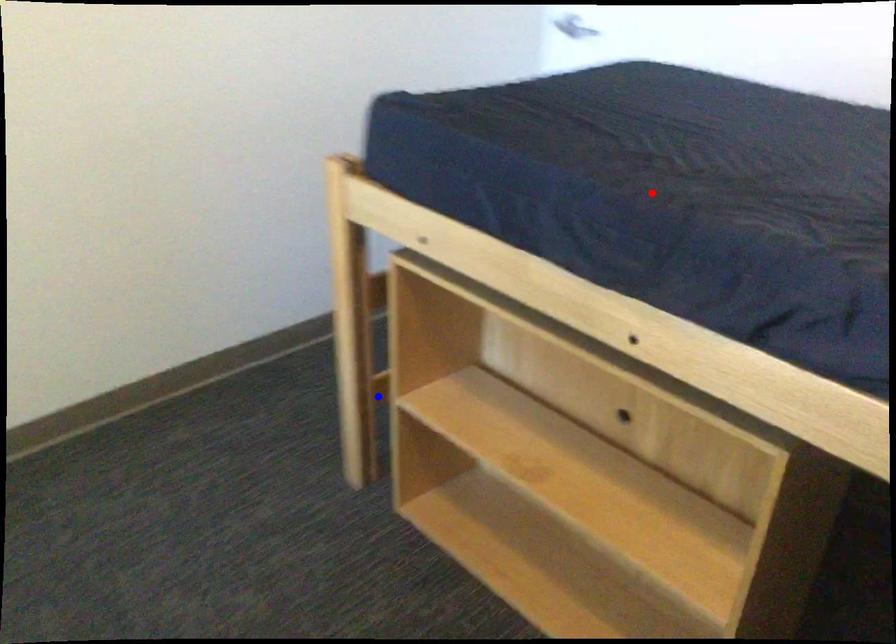
Question: In the image, two points are highlighted. Which point is nearer to the camera? Reply with the corresponding letter.

Choices:
 (A) blue point
 (B) red point

Answer: (B)